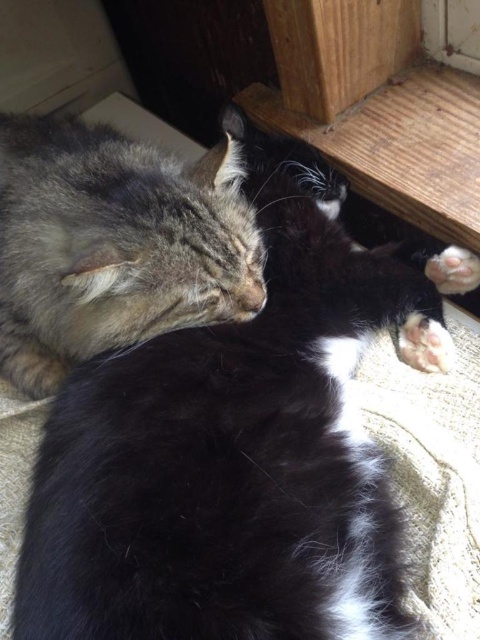
I want to click on gray fur cat at upper left, so click(113, 244).

Locate an element on the screen. The width and height of the screenshot is (480, 640). gray fur cat at upper left is located at coordinates (113, 244).

Between white soft paw at lower right and white soft fur paw at lower right, which one appears on the right side from the viewer's perspective?

Positioned to the right is white soft fur paw at lower right.

Which is more to the left, white soft paw at lower right or white soft fur paw at lower right?

Positioned to the left is white soft paw at lower right.

Is point (433, 342) positioned in front of point (468, 256)?

Yes.

Where is `white soft paw at lower right`? The image size is (480, 640). white soft paw at lower right is located at coordinates (424, 342).

Does gray fur cat at upper left come behind white soft fur paw at lower right?

No.

Between gray fur cat at upper left and white soft fur paw at lower right, which one has more height?

With more height is gray fur cat at upper left.

Find the location of a particular element. gray fur cat at upper left is located at coordinates click(113, 244).